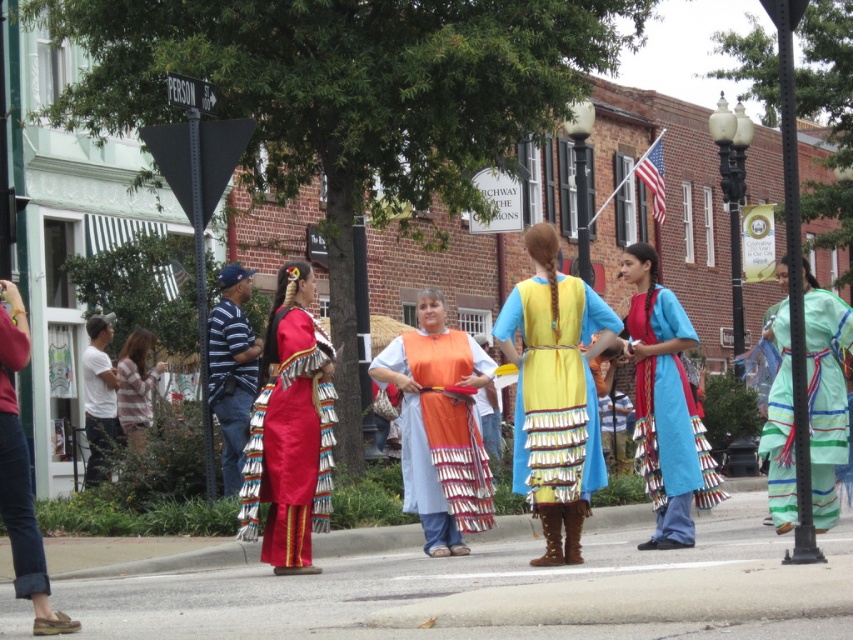
You are a photographer trying to capture both the shiny satin dress at center and the light green striped fabric dress at center in a single frame. Since the dresses are positioned at the same location, which dress should you focus on first to ensure the thinner one is properly framed?

The shiny satin dress at center is thinner than the light green striped fabric dress at center, so you should focus on the shiny satin dress at center first to ensure it is properly framed before the wider one.

You are a photographer at the event, and you need to capture both the shiny satin dress at center and the light green striped fabric dress at center in a single shot. Which dress should you position closer to the left side of the frame to include both?

The shiny satin dress at center is already positioned to the left of the light green striped fabric dress at center, so you can position the shiny satin dress at center closer to the left side of the frame to include both in the shot.